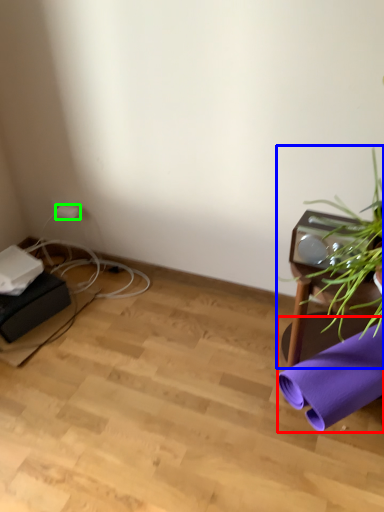
Question: Which is nearer to the beach towel (highlighted by a red box)? houseplant (highlighted by a blue box) or plug (highlighted by a green box).

Choices:
 (A) houseplant
 (B) plug

Answer: (A)